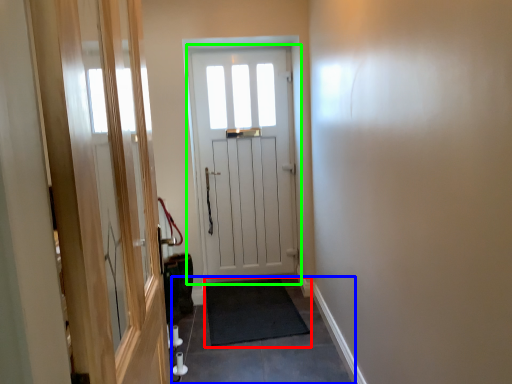
Question: Which object is the closest to the doormat (highlighted by a red box)? Choose among these: path (highlighted by a blue box) or door (highlighted by a green box).

Choices:
 (A) path
 (B) door

Answer: (A)